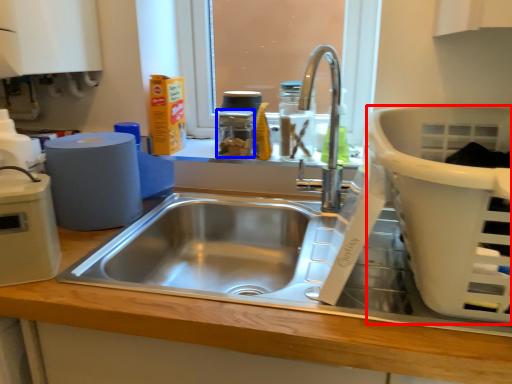
Question: Among these objects, which one is farthest to the camera, basket (highlighted by a red box) or appliance (highlighted by a blue box)?

Choices:
 (A) basket
 (B) appliance

Answer: (B)